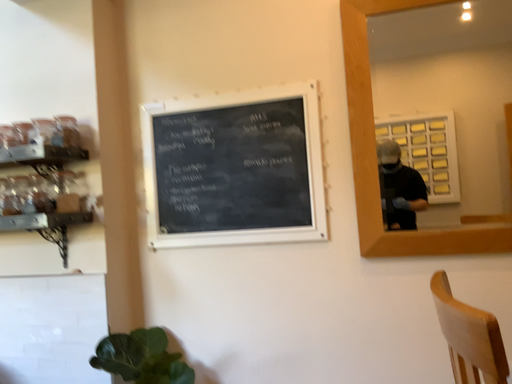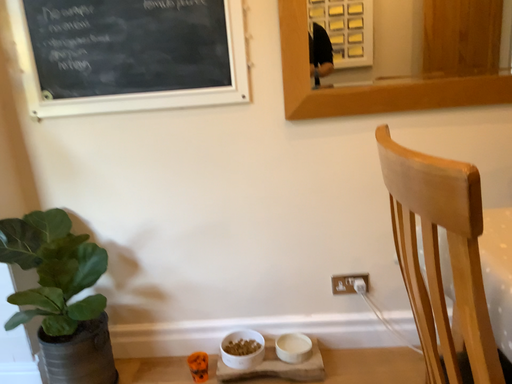
Question: How did the camera likely rotate when shooting the video?

Choices:
 (A) rotated left
 (B) rotated right

Answer: (B)